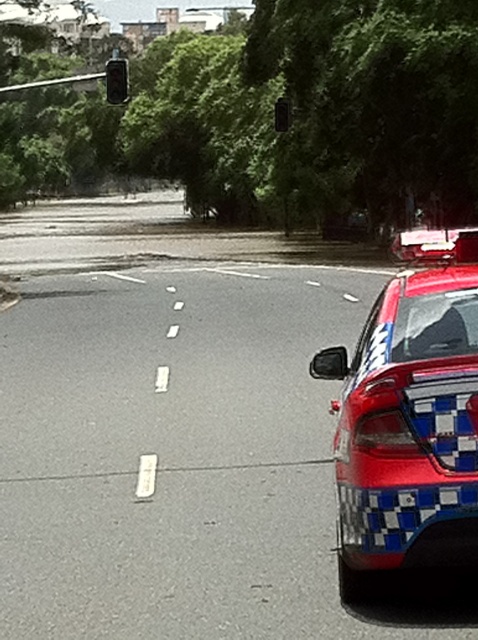
You are a drone operator trying to capture aerial footage of the police car. You have two points marked in the scene for reference. Point A is at coordinates point (417,268) and Point B is at coordinates point (279,106). Which point is closer to your camera position?

Point A at point (417,268) is closer to the camera than point B at point (279,106).

You are a pedestrian standing at the point marked by the coordinates point [409,424]. Looking around, you see the red glossy police car at right. Which direction should you walk to move away from the red glossy police car at right?

The point [409,424] marks the red glossy police car at right, so walking in any direction away from this point would move you away from the red glossy police car at right.

You are standing on the street and see two points marked in the image. Which point, point (120, 65) or point (286, 116), is closer to you?

Point (120, 65) is closer to the viewer than point (286, 116).